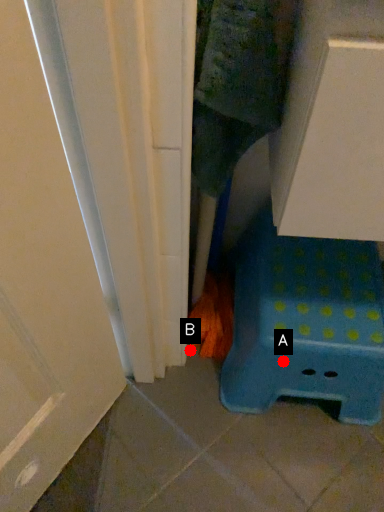
Question: Two points are circled on the image, labeled by A and B beside each circle. Which point is farther to the camera?

Choices:
 (A) A is further
 (B) B is further

Answer: (B)